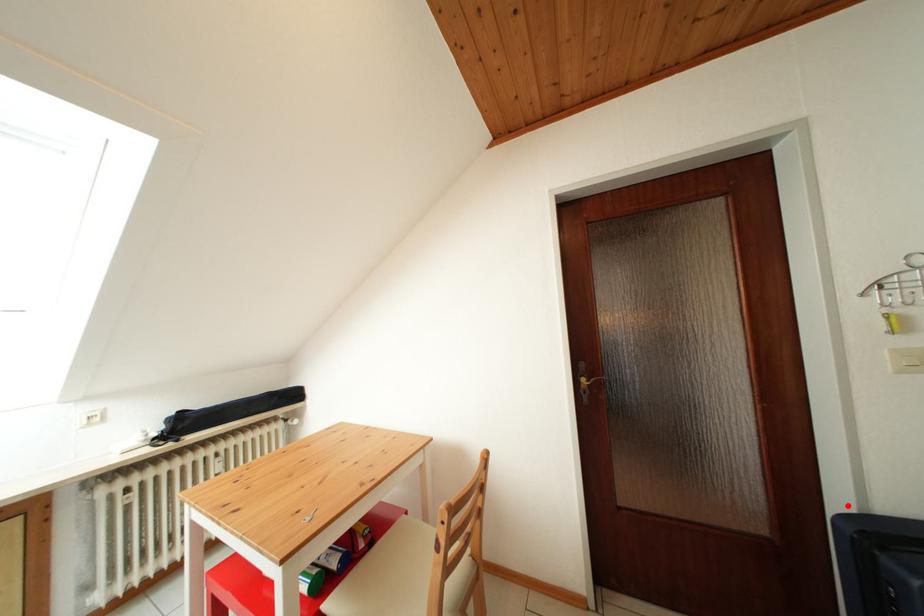
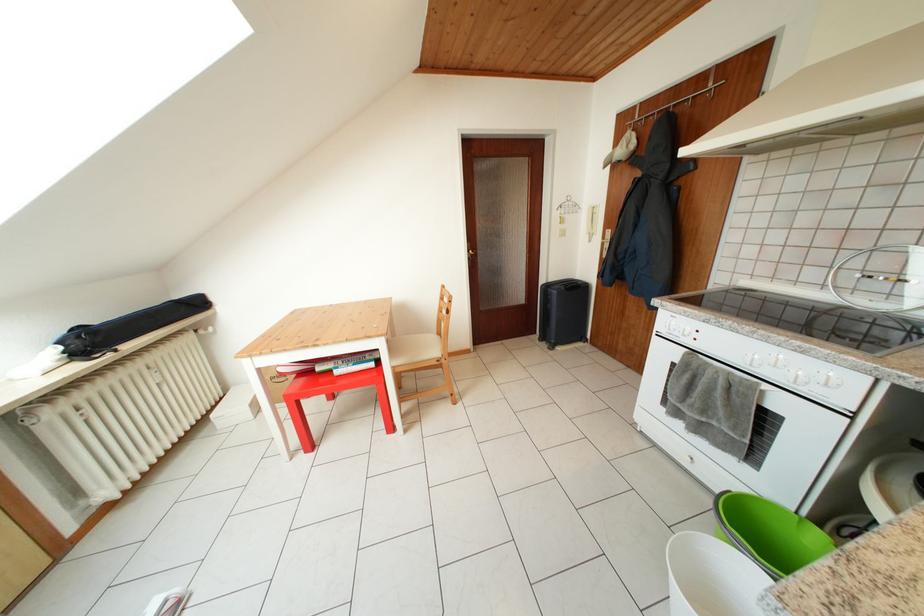
Question: I am providing you with two images of the same scene from different viewpoints. In image1, a red point is highlighted. Considering the same 3D point in image2, which of the following is correct?

Choices:
 (A) It is closer
 (B) It is farther

Answer: (A)